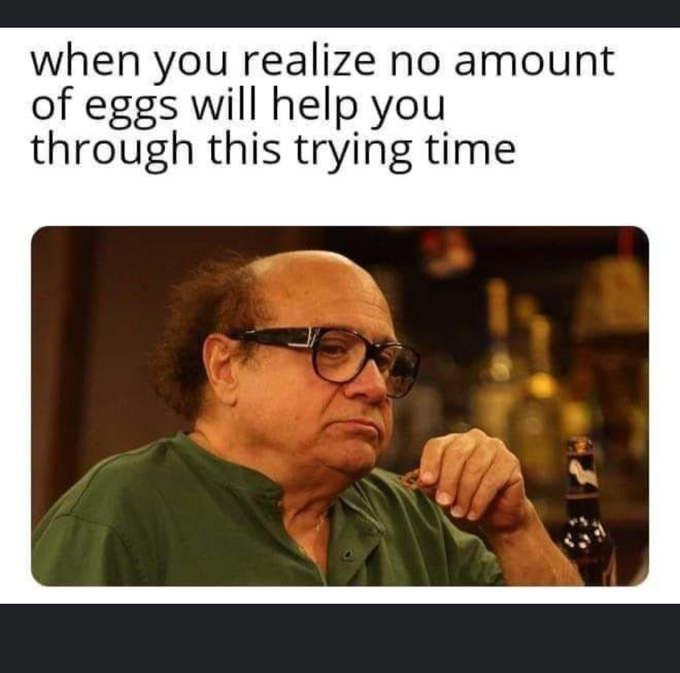
I want to click on bottle towards the bottom right, so click(x=598, y=538).